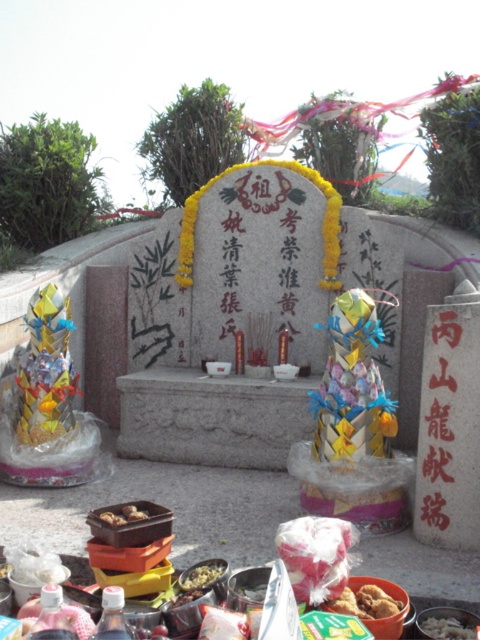
In the scene shown: Can you confirm if shiny plastic container at center is wider than shiny metallic bowl at center?

Yes, shiny plastic container at center is wider than shiny metallic bowl at center.

Who is lower down, shiny plastic container at center or shiny metallic bowl at center?

shiny metallic bowl at center is lower down.

Where is `shiny plastic container at center`? This screenshot has height=640, width=480. shiny plastic container at center is located at coordinates (202, 573).

Does point (35, 320) come farther from viewer compared to point (130, 518)?

Yes, it is behind point (130, 518).

Does shiny metallic toy at left appear on the right side of brown matte food at center?

No, shiny metallic toy at left is not to the right of brown matte food at center.

This screenshot has height=640, width=480. I want to click on shiny metallic toy at left, so click(46, 371).

The height and width of the screenshot is (640, 480). Find the location of `shiny metallic toy at left`. shiny metallic toy at left is located at coordinates (46, 371).

Based on the photo, how much distance is there between brown crispy fried food at center and brown matte food at center?

brown crispy fried food at center and brown matte food at center are 26.74 inches apart from each other.

Is the position of brown crispy fried food at center more distant than that of brown matte food at center?

No, brown crispy fried food at center is in front of brown matte food at center.

Between point (386, 593) and point (132, 516), which one is positioned behind?

Point (132, 516)

You are a GUI agent. You are given a task and a screenshot of the screen. Output one action in this format:
    pyautogui.click(x=<x>, y=<y>)
    Task: Click on the brown crispy fried food at center
    The image size is (480, 640).
    Given the screenshot: What is the action you would take?
    pyautogui.click(x=365, y=602)